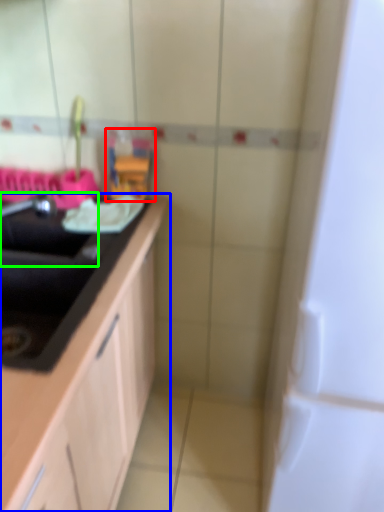
Question: Which object is positioned closest to toy (highlighted by a red box)? Select from countertop (highlighted by a blue box) and sink (highlighted by a green box).

Choices:
 (A) countertop
 (B) sink

Answer: (B)